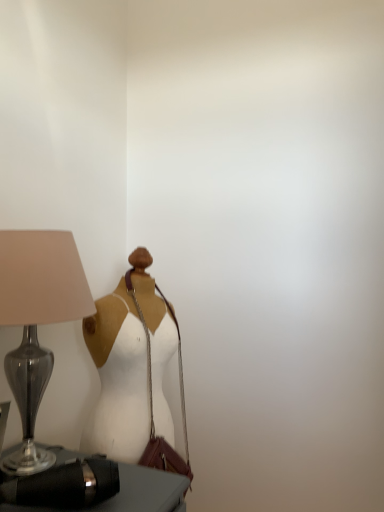
Identify the location of leather shoulder bag at center. This screenshot has height=512, width=384. (152, 407).

Locate an element on the screen. matte glass lamp at left is located at coordinates (37, 322).

Does white matte dress at center have a greater width compared to leather shoulder bag at center?

Indeed, white matte dress at center has a greater width compared to leather shoulder bag at center.

From the image's perspective, is white matte dress at center located above or below leather shoulder bag at center?

Clearly, from the image's perspective, white matte dress at center is above leather shoulder bag at center.

Looking at this image, from a real-world perspective, is white matte dress at center positioned under leather shoulder bag at center based on gravity?

No, from a real-world perspective, white matte dress at center is not beneath leather shoulder bag at center.

Which of these two, white matte dress at center or leather shoulder bag at center, is smaller?

Smaller between the two is leather shoulder bag at center.

From the image's perspective, is black leather bag at lower left on white matte dress at center?

No, from the image's perspective, black leather bag at lower left is not over white matte dress at center.

Is black leather bag at lower left turned away from white matte dress at center?

black leather bag at lower left does not have its back to white matte dress at center.

Identify the location of fancy dress above the black leather bag at lower left (from the image's perspective). The image size is (384, 512). (120, 387).

From a real-world perspective, between black leather bag at lower left and white matte dress at center, who is vertically higher?

In real-world perspective, white matte dress at center is above.

Is white matte dress at center inside leather shoulder bag at center?

Yes, white matte dress at center is inside leather shoulder bag at center.

Does point (160, 449) come closer to viewer compared to point (127, 404)?

No, it is not.

Considering the sizes of objects leather shoulder bag at center and white matte dress at center in the image provided, who is taller, leather shoulder bag at center or white matte dress at center?

white matte dress at center.

Does leather shoulder bag at center have a smaller size compared to white matte dress at center?

Yes, leather shoulder bag at center is smaller than white matte dress at center.

Which of these two, matte glass lamp at left or leather shoulder bag at center, is thinner?

Thinner between the two is leather shoulder bag at center.

Does matte glass lamp at left touch leather shoulder bag at center?

No, matte glass lamp at left is not beside leather shoulder bag at center.

From the image's perspective, does matte glass lamp at left appear higher than leather shoulder bag at center?

Correct, matte glass lamp at left appears higher than leather shoulder bag at center in the image.

Between matte glass lamp at left and leather shoulder bag at center, which one is positioned behind?

leather shoulder bag at center.

Could you tell me if matte glass lamp at left is facing white matte dress at center?

No, matte glass lamp at left is not aimed at white matte dress at center.

How different are the orientations of matte glass lamp at left and white matte dress at center in degrees?

matte glass lamp at left and white matte dress at center are facing 21.4 degrees away from each other.

Considering the sizes of objects matte glass lamp at left and white matte dress at center in the image provided, who is taller, matte glass lamp at left or white matte dress at center?

white matte dress at center is taller.

From the image's perspective, which object appears higher, matte glass lamp at left or white matte dress at center?

matte glass lamp at left, from the image's perspective.

Does white matte dress at center lie behind matte glass lamp at left?

Yes, the depth of white matte dress at center is greater than that of matte glass lamp at left.

Between point (117, 457) and point (64, 317), which one is positioned behind?

Positioned behind is point (117, 457).

From a real-world perspective, between white matte dress at center and matte glass lamp at left, who is vertically lower?

white matte dress at center, from a real-world perspective.

Which is more to the left, white matte dress at center or matte glass lamp at left?

Positioned to the left is matte glass lamp at left.

Is white matte dress at center facing away from black leather bag at lower left?

That's not correct — white matte dress at center is not looking away from black leather bag at lower left.

Does white matte dress at center touch black leather bag at lower left?

No, white matte dress at center is not beside black leather bag at lower left.

Looking at this image, how far apart are white matte dress at center and black leather bag at lower left?

white matte dress at center is 9.58 inches from black leather bag at lower left.

Find the location of `shoulder bag behind the white matte dress at center`. shoulder bag behind the white matte dress at center is located at coordinates click(152, 407).

The height and width of the screenshot is (512, 384). Find the location of `fancy dress on the right of black leather bag at lower left`. fancy dress on the right of black leather bag at lower left is located at coordinates (120, 387).

Consider the image. Based on their spatial positions, is leather shoulder bag at center or matte glass lamp at left further from white matte dress at center?

Based on the image, matte glass lamp at left appears to be further to white matte dress at center.

In the scene shown: Based on their spatial positions, is black leather bag at lower left or matte glass lamp at left closer to white matte dress at center?

Based on the image, matte glass lamp at left appears to be nearer to white matte dress at center.

When comparing their distances from leather shoulder bag at center, does matte glass lamp at left or black leather bag at lower left seem closer?

black leather bag at lower left is closer to leather shoulder bag at center.

Which object lies further to the anchor point black leather bag at lower left, leather shoulder bag at center or matte glass lamp at left?

The object further to black leather bag at lower left is matte glass lamp at left.

Estimate the real-world distances between objects in this image. Which object is further from black leather bag at lower left, matte glass lamp at left or white matte dress at center?

white matte dress at center is further to black leather bag at lower left.

From the image, which object appears to be nearer to matte glass lamp at left, black leather bag at lower left or leather shoulder bag at center?

black leather bag at lower left is positioned closer to the anchor matte glass lamp at left.

Consider the image. From the image, which object appears to be farther from matte glass lamp at left, white matte dress at center or leather shoulder bag at center?

leather shoulder bag at center is positioned further to the anchor matte glass lamp at left.

From the image, which object appears to be farther from black leather bag at lower left, white matte dress at center or leather shoulder bag at center?

white matte dress at center lies further to black leather bag at lower left than the other object.

Image resolution: width=384 pixels, height=512 pixels. I want to click on lamp located between black leather bag at lower left and white matte dress at center in the depth direction, so click(37, 322).

Locate an element on the screen. Image resolution: width=384 pixels, height=512 pixels. lamp between black leather bag at lower left and leather shoulder bag at center from front to back is located at coordinates (37, 322).

The width and height of the screenshot is (384, 512). Find the location of `fancy dress between matte glass lamp at left and leather shoulder bag at center in the front-back direction`. fancy dress between matte glass lamp at left and leather shoulder bag at center in the front-back direction is located at coordinates (120, 387).

The height and width of the screenshot is (512, 384). I want to click on fancy dress between black leather bag at lower left and leather shoulder bag at center along the z-axis, so click(120, 387).